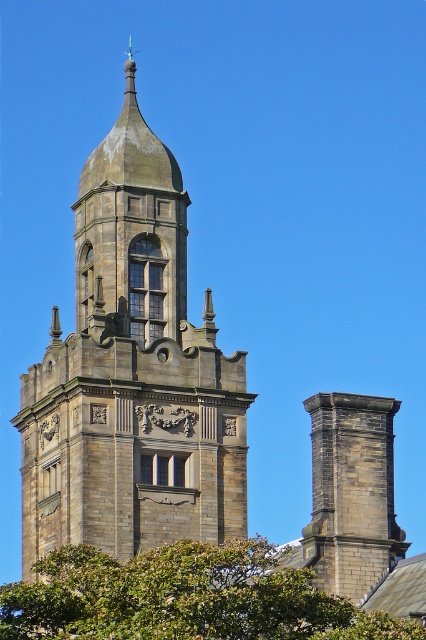
Is stone tower at center further to the viewer compared to green leafy tree at lower center?

Yes, stone tower at center is behind green leafy tree at lower center.

Does stone tower at center appear over green leafy tree at lower center?

Yes.

Does point (192, 356) lie behind point (236, 616)?

Yes, point (192, 356) is farther from viewer.

I want to click on stone tower at center, so click(x=132, y=374).